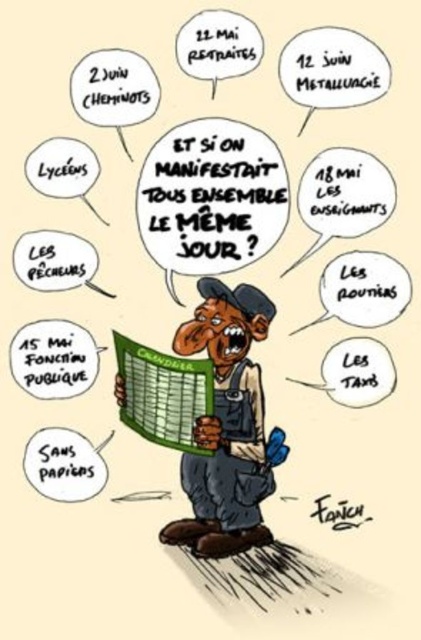
Is point (202, 525) in front of point (264, 486)?

Yes.

Locate an element on the screen. matte overalls at center is located at coordinates (228, 426).